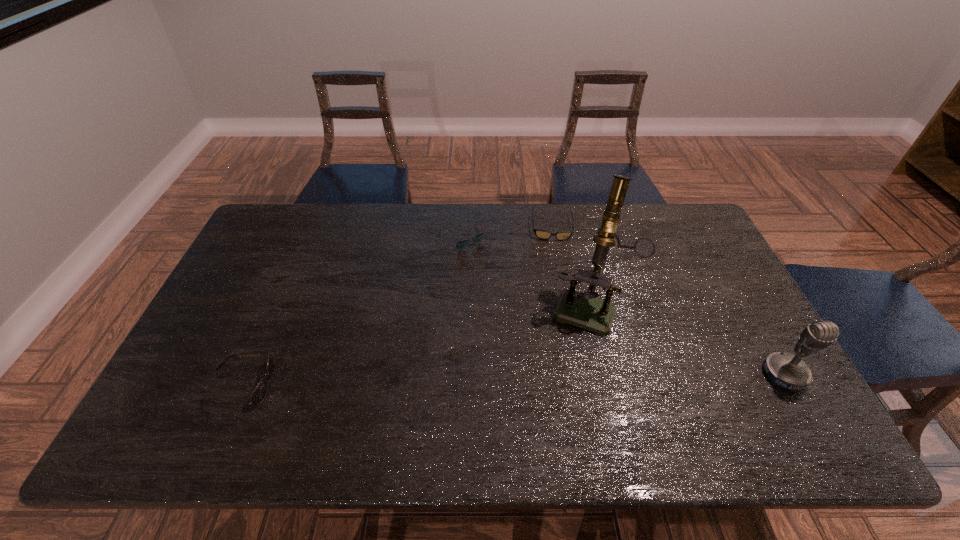
The image size is (960, 540). In order to click on free space between the fourth object from right to left and the third farthest object in this screenshot , I will do `click(525, 272)`.

Image resolution: width=960 pixels, height=540 pixels. What are the coordinates of `vacant point located between the rightmost object and the leftmost sunglasses` in the screenshot? It's located at (513, 380).

The image size is (960, 540). I want to click on free space between the tallest object and the rightmost object, so click(x=686, y=341).

Where is `empty location between the third nearest object and the second object from left to right`? empty location between the third nearest object and the second object from left to right is located at coordinates (525, 272).

The height and width of the screenshot is (540, 960). Identify the location of free space between the leftmost object and the rightmost sunglasses. (396, 306).

The width and height of the screenshot is (960, 540). Identify the location of empty space between the rightmost object and the tallest object. (686, 341).

This screenshot has width=960, height=540. I want to click on free space that is in between the leftmost object and the microphone, so click(513, 380).

You are a GUI agent. You are given a task and a screenshot of the screen. Output one action in this format:
    pyautogui.click(x=<x>, y=<y>)
    Task: Click on the free area in between the nearest sunglasses and the second sunglasses from right to left
    
    Given the screenshot: What is the action you would take?
    pyautogui.click(x=351, y=311)

Identify the location of free space between the fourth object from right to left and the rightmost sunglasses. (507, 232).

The width and height of the screenshot is (960, 540). I want to click on unoccupied area between the rightmost object and the microscope, so click(x=686, y=341).